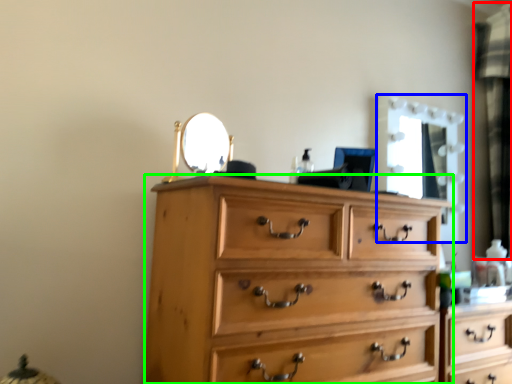
Question: Which object is the closest to the curtain (highlighted by a red box)? Choose among these: mirror (highlighted by a blue box) or chest of drawers (highlighted by a green box).

Choices:
 (A) mirror
 (B) chest of drawers

Answer: (A)